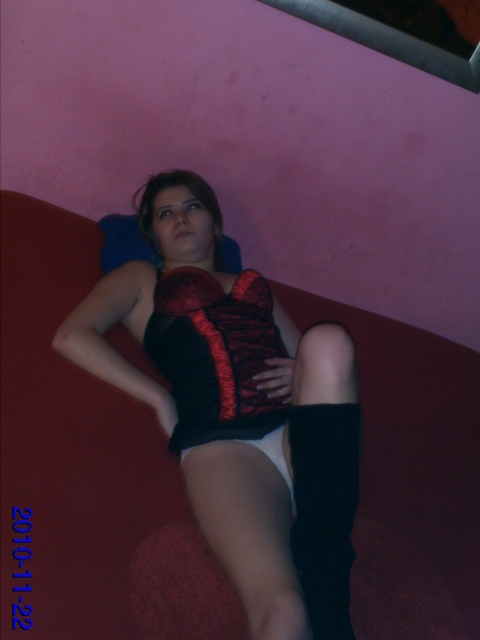
Question: Which object is farther from the camera taking this photo?

Choices:
 (A) black satin corset at center
 (B) black lace corset at center
 (C) white matte underwear at lower center

Answer: (B)

Question: Which point is farther to the camera?

Choices:
 (A) black satin corset at center
 (B) white matte underwear at lower center
 (C) black lace corset at center

Answer: (C)

Question: Is black satin corset at center above black lace corset at center?

Choices:
 (A) yes
 (B) no

Answer: (B)

Question: Among these points, which one is nearest to the camera?

Choices:
 (A) (165, 352)
 (B) (280, 444)
 (C) (205, 486)

Answer: (C)

Question: Does black lace corset at center have a lesser width compared to white matte underwear at lower center?

Choices:
 (A) yes
 (B) no

Answer: (B)

Question: Is black lace corset at center positioned at the back of white matte underwear at lower center?

Choices:
 (A) no
 (B) yes

Answer: (B)